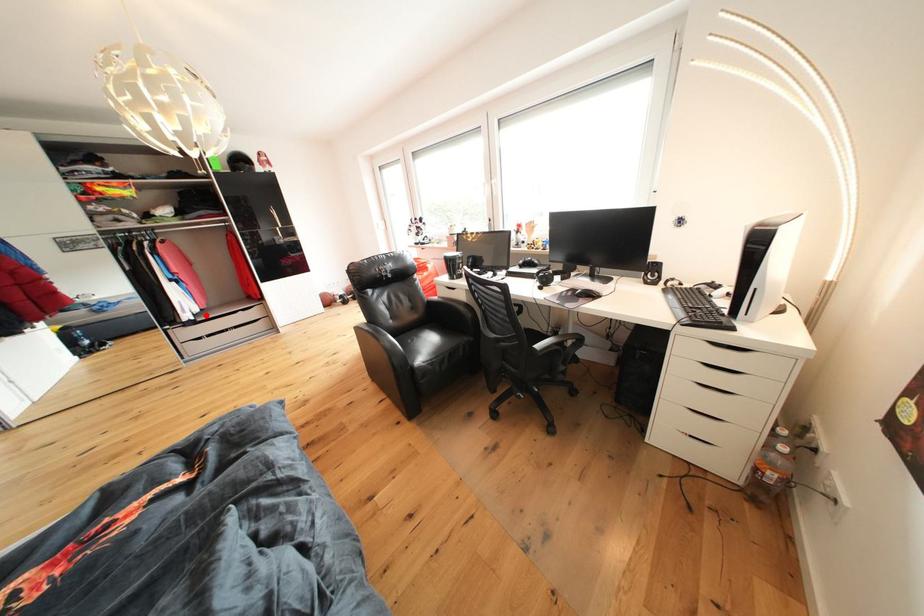
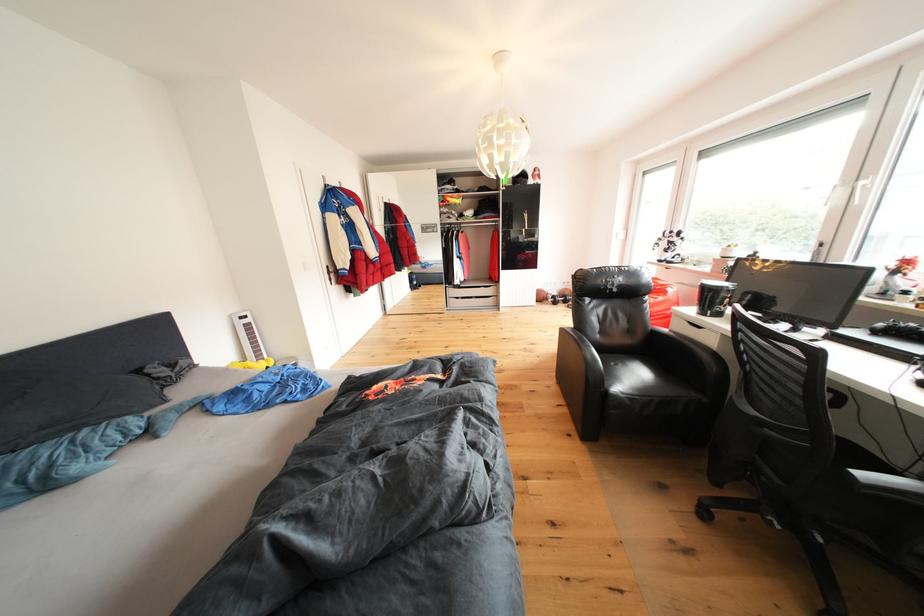
Where in the second image is the point corresponding to the highlighted location from the first image?

(470, 284)